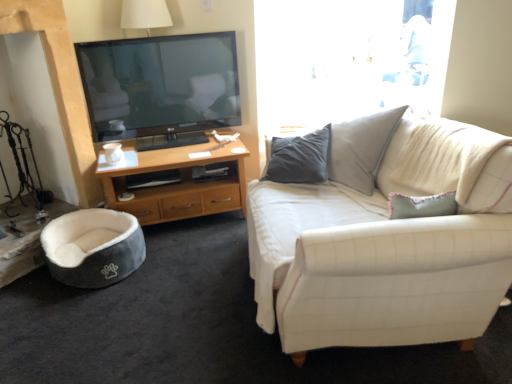
Identify the location of vacant space in between white fabric couch at right and velvet grey bean bag at lower left. (188, 304).